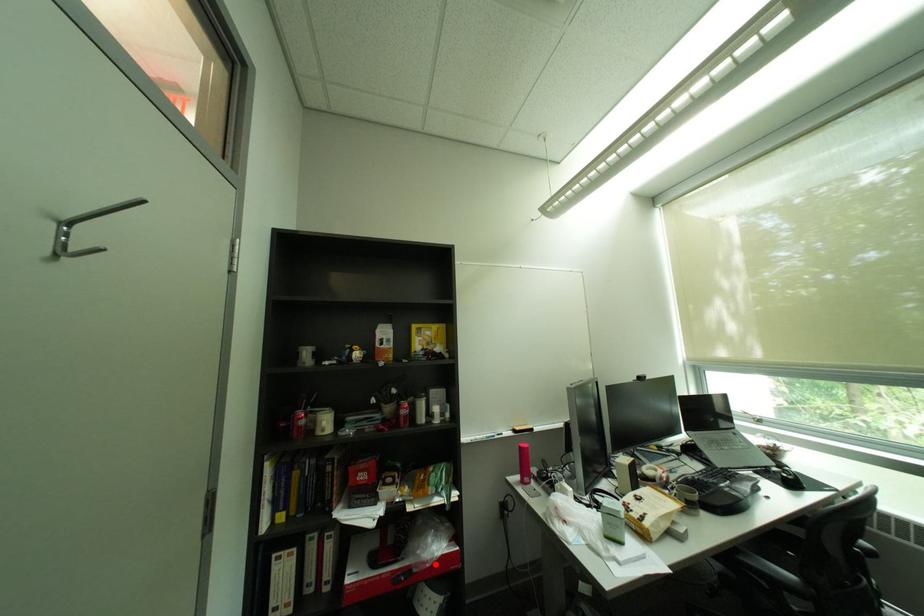
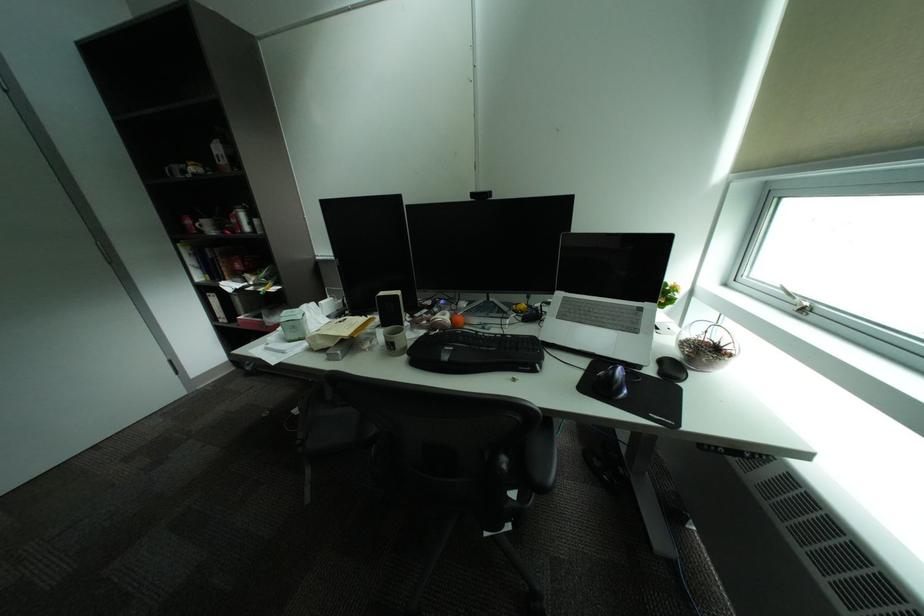
Where in the second image is the point corresponding to the highlighted location from the first image?

(281, 323)